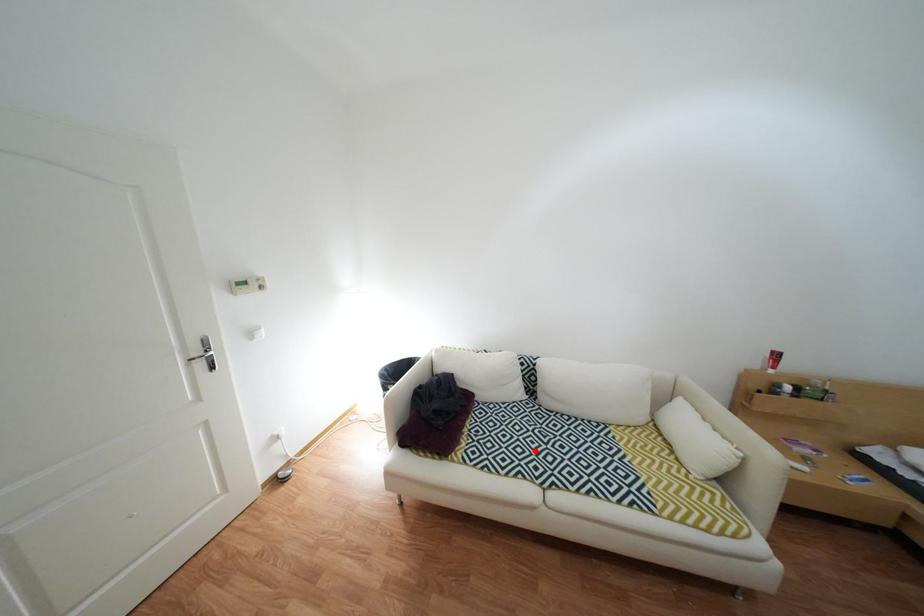
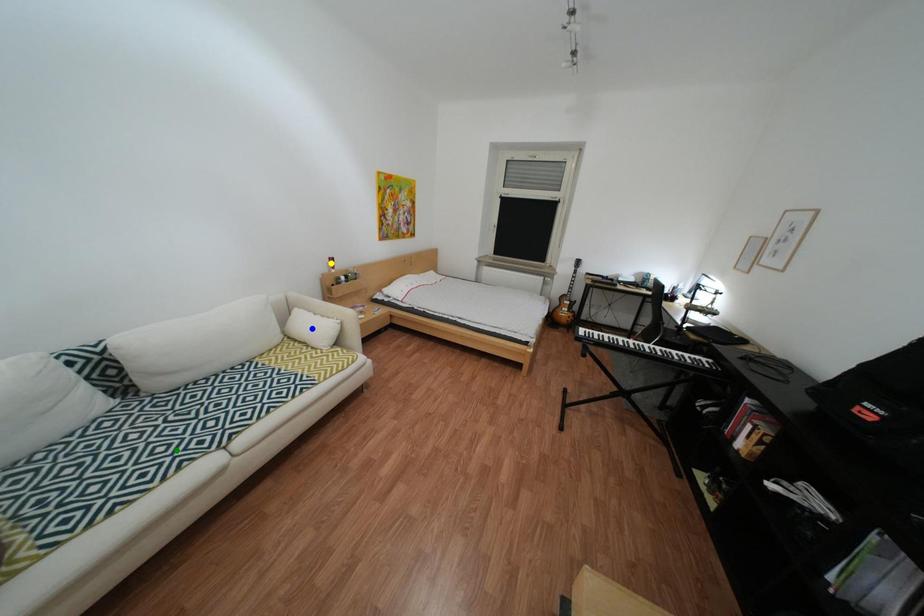
Question: I am providing you with two images of the same scene from different viewpoints. A red point is marked on the first image. You are given multiple points on the second image. Which point in image 2 represents the same 3d spot as the red point in image 1?

Choices:
 (A) blue point
 (B) green point
 (C) yellow point

Answer: (B)